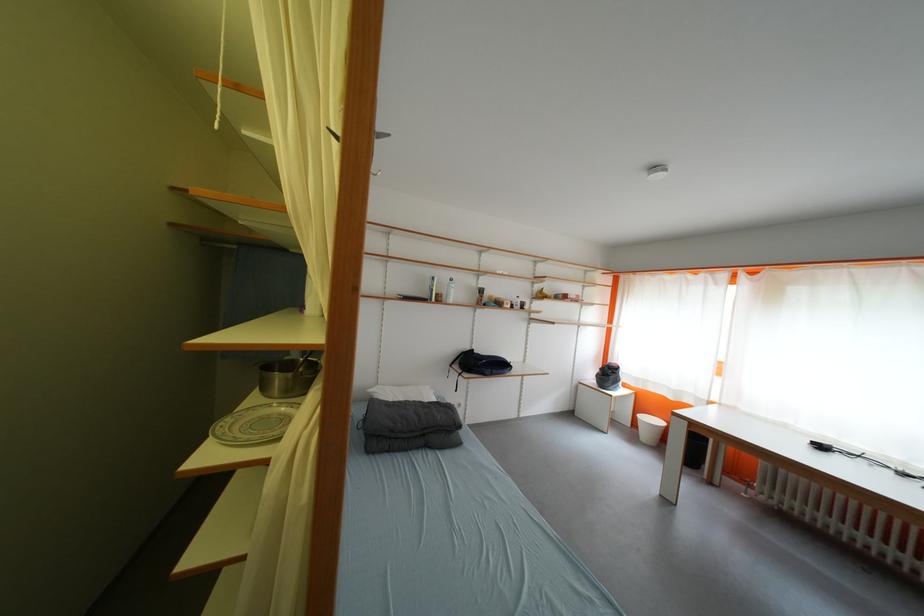
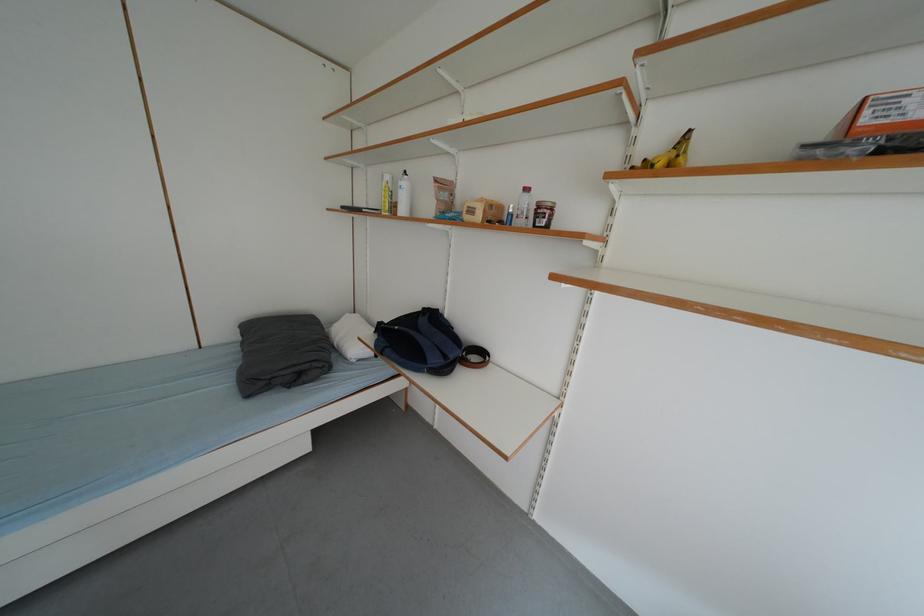
Find the pixel in the second image that matches pixel 517 310 in the first image.

(487, 220)